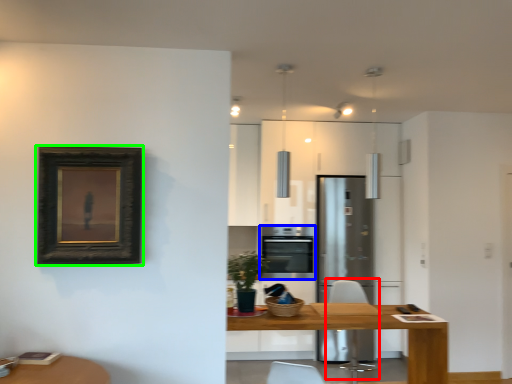
Question: Which is nearer to the swivel chair (highlighted by a red box)? oven (highlighted by a blue box) or picture frame (highlighted by a green box).

Choices:
 (A) oven
 (B) picture frame

Answer: (A)